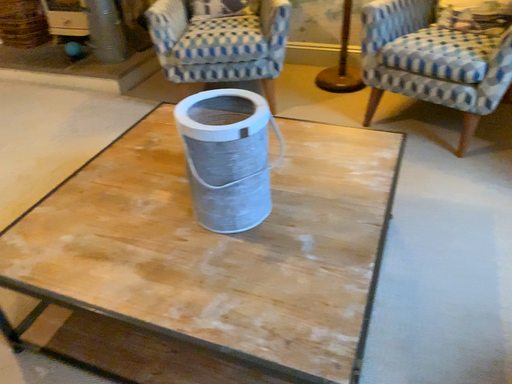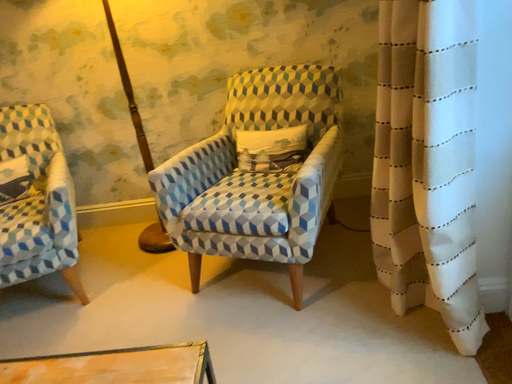
Question: How did the camera likely rotate when shooting the video?

Choices:
 (A) rotated left
 (B) rotated right

Answer: (B)